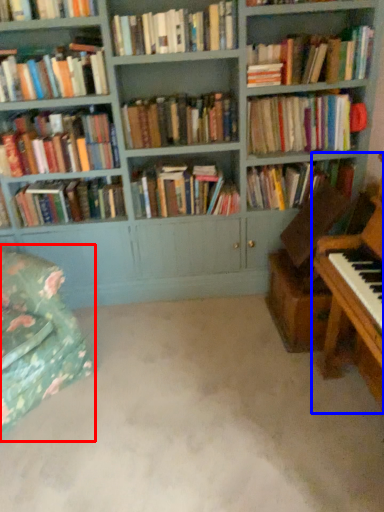
Question: Which object appears farthest to the camera in this image, swivel chair (highlighted by a red box) or piano (highlighted by a blue box)?

Choices:
 (A) swivel chair
 (B) piano

Answer: (A)